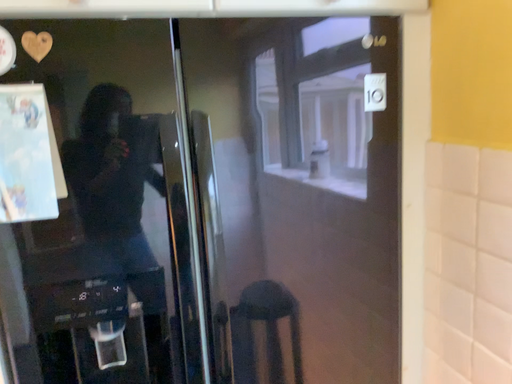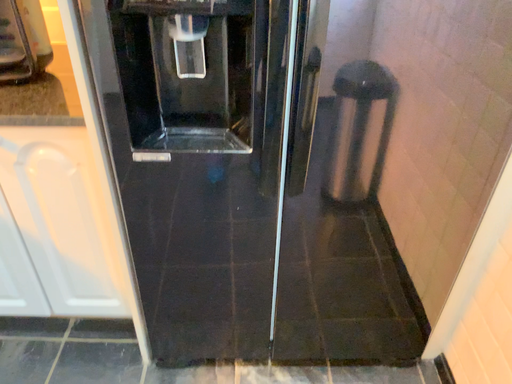
Question: Which way did the camera rotate in the video?

Choices:
 (A) rotated right
 (B) rotated left

Answer: (B)